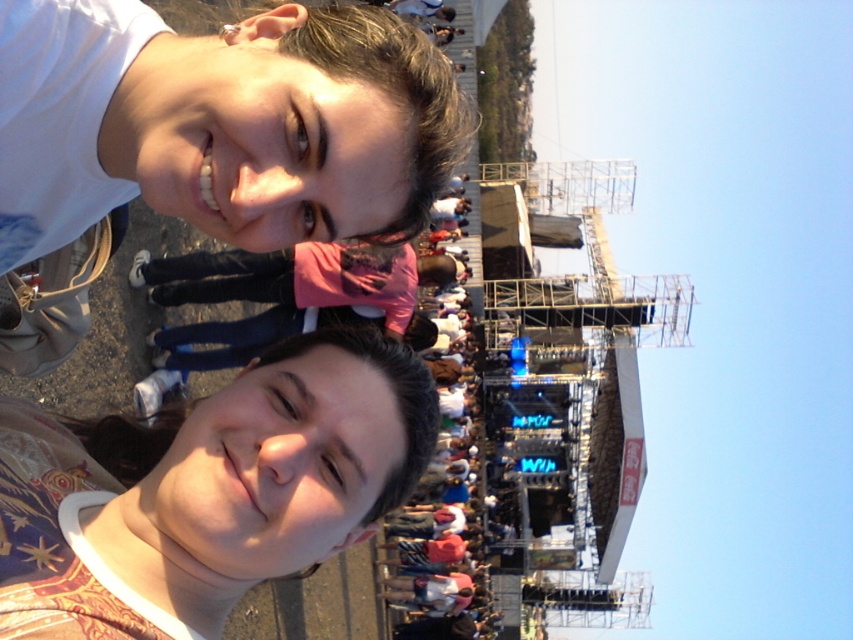
Which is more to the left, matte white face at upper left or matte floral shirt at lower left?

From the viewer's perspective, matte floral shirt at lower left appears more on the left side.

Does matte white face at upper left have a lesser width compared to matte floral shirt at lower left?

Incorrect, matte white face at upper left's width is not less than matte floral shirt at lower left's.

Is point (410, 208) positioned before point (366, 410)?

Yes, it is in front of point (366, 410).

Where is `matte white face at upper left`? matte white face at upper left is located at coordinates (219, 124).